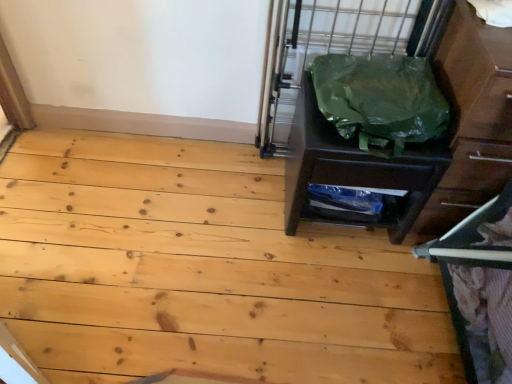
Question: Considering the positions of matte brown dresser at right and natural wood floor at center in the image, is matte brown dresser at right wider or thinner than natural wood floor at center?

Choices:
 (A) wide
 (B) thin

Answer: (B)

Question: Considering the positions of point (458, 18) and point (40, 195), is point (458, 18) closer or farther from the camera than point (40, 195)?

Choices:
 (A) closer
 (B) farther

Answer: (A)

Question: Estimate the real-world distances between objects in this image. Which object is farther from the matte brown dresser at right?

Choices:
 (A) metallic gray bunk bed at right
 (B) natural wood floor at center
 (C) green plastic bag at right
 (D) green plastic bag at right

Answer: (B)

Question: Estimate the real-world distances between objects in this image. Which object is farther from the metallic gray bunk bed at right?

Choices:
 (A) matte brown dresser at right
 (B) natural wood floor at center
 (C) green plastic bag at right
 (D) green plastic bag at right

Answer: (B)